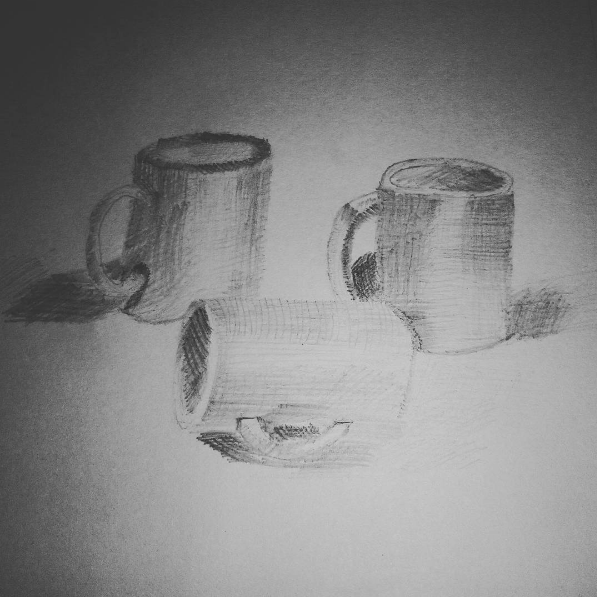
At what (x,y) coordinates should I click in order to perform the action: click on shadows of cups. Please return your answer as a coordinate pair (x, y). Looking at the image, I should click on (543, 316), (221, 445), (66, 309).